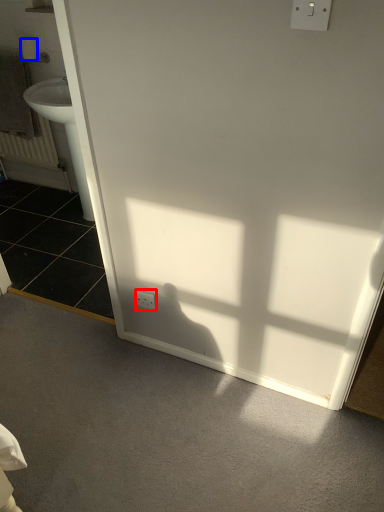
Question: Which point is further to the camera, electric outlet (highlighted by a red box) or toilet paper (highlighted by a blue box)?

Choices:
 (A) electric outlet
 (B) toilet paper

Answer: (B)